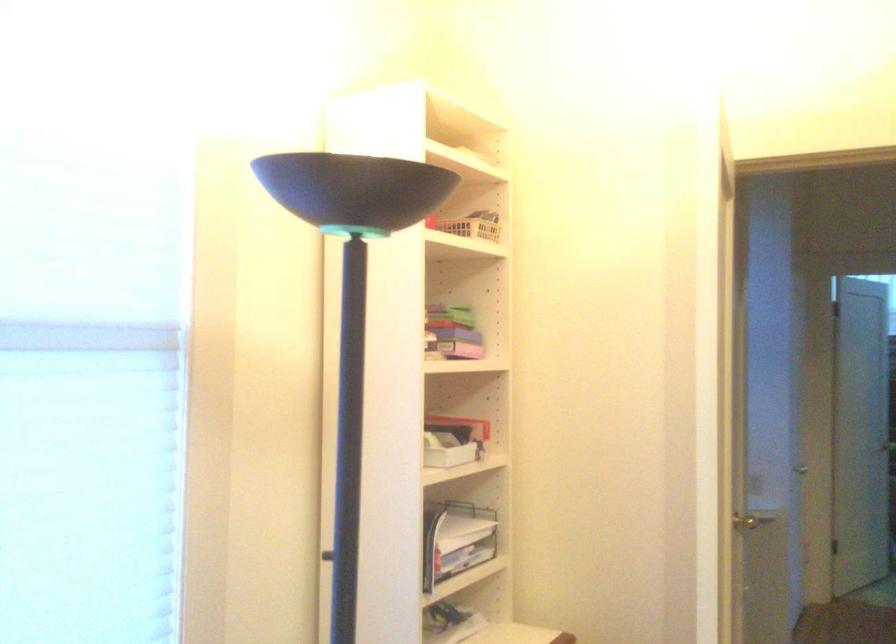
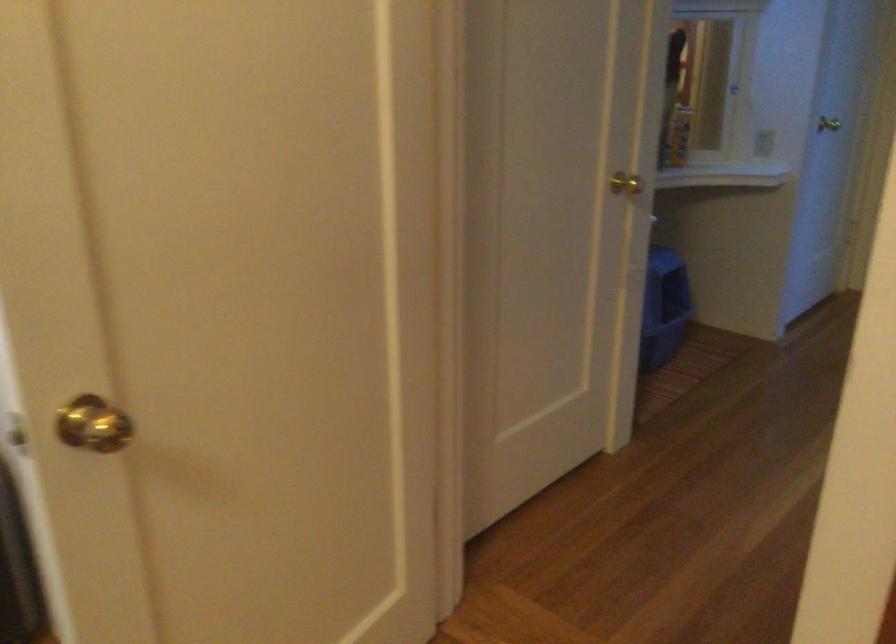
Where in the second image is the point corresponding to pixel 778 486 from the first image?

(762, 143)